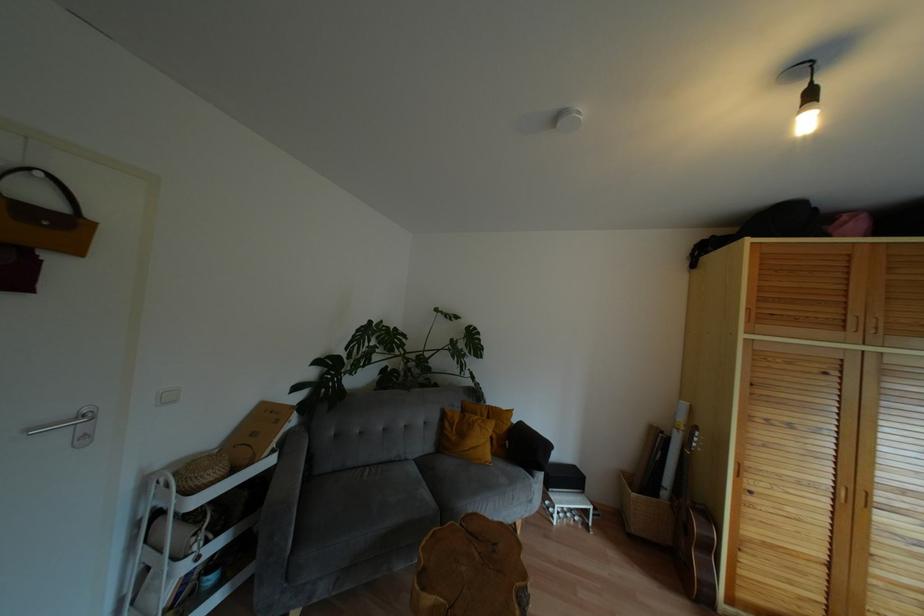
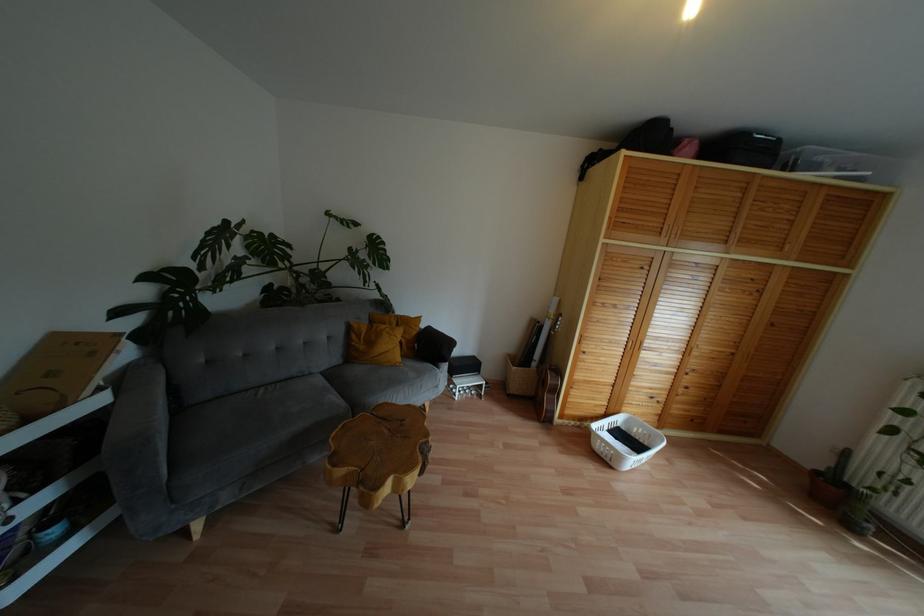
Consider the image. The images are taken continuously from a first-person perspective. In which direction are you moving?

The cameraman walked toward right, forward.